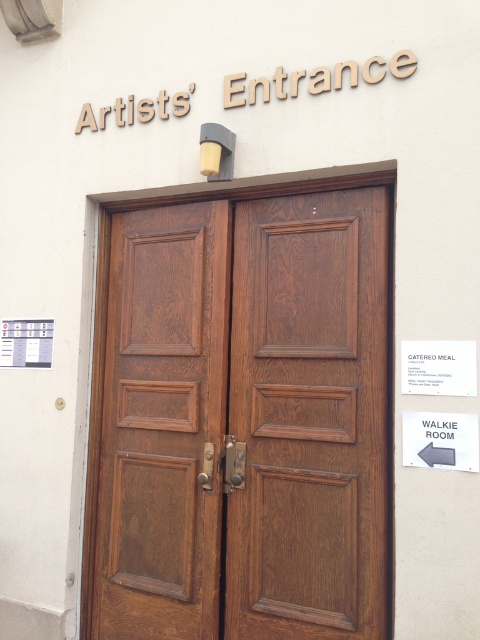
Which is in front, point (151, 307) or point (3, 321)?

Point (151, 307) is more forward.

This screenshot has width=480, height=640. What do you see at coordinates (156, 422) in the screenshot? I see `wooden door at center` at bounding box center [156, 422].

What do you see at coordinates (156, 422) in the screenshot?
I see `wooden door at center` at bounding box center [156, 422].

The width and height of the screenshot is (480, 640). I want to click on wooden door at center, so click(156, 422).

Does brown wood door at center have a smaller size compared to wooden door at center?

Actually, brown wood door at center might be larger than wooden door at center.

Identify the location of brown wood door at center. (240, 416).

What do you see at coordinates (240, 416) in the screenshot? The width and height of the screenshot is (480, 640). I see `brown wood door at center` at bounding box center [240, 416].

Locate an element on the screen. Image resolution: width=480 pixels, height=640 pixels. brown wood door at center is located at coordinates (240, 416).

Image resolution: width=480 pixels, height=640 pixels. Find the location of `brown wood door at center`. brown wood door at center is located at coordinates (240, 416).